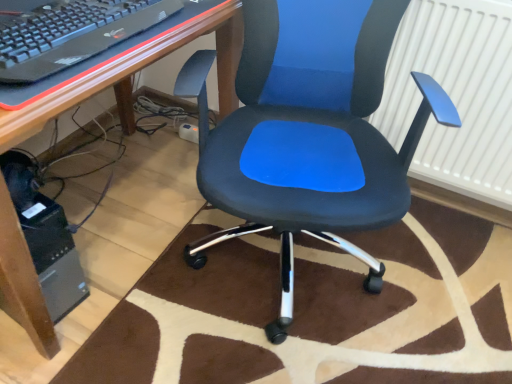
Identify the location of empty space that is to the right of black plastic computer tower at lower left. The height and width of the screenshot is (384, 512). (99, 296).